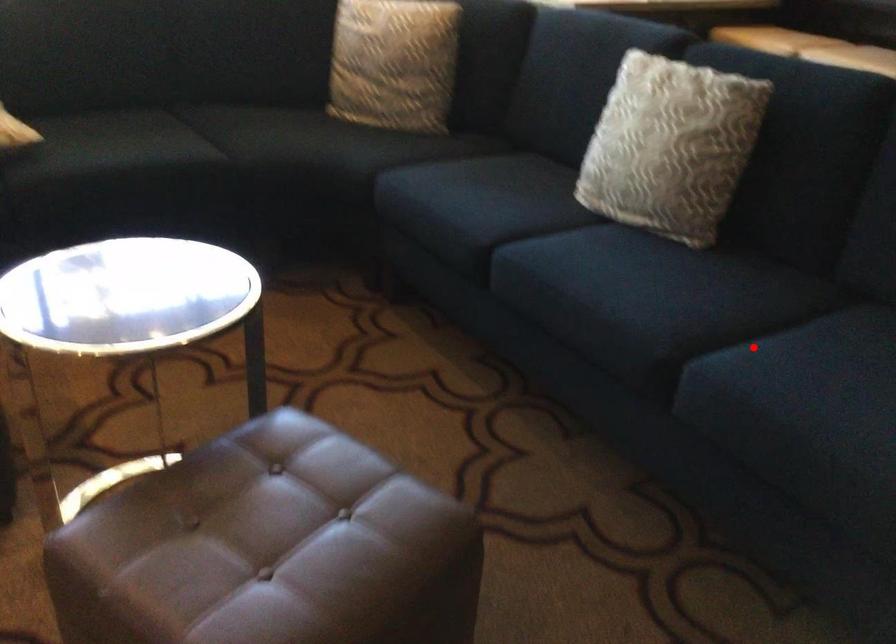
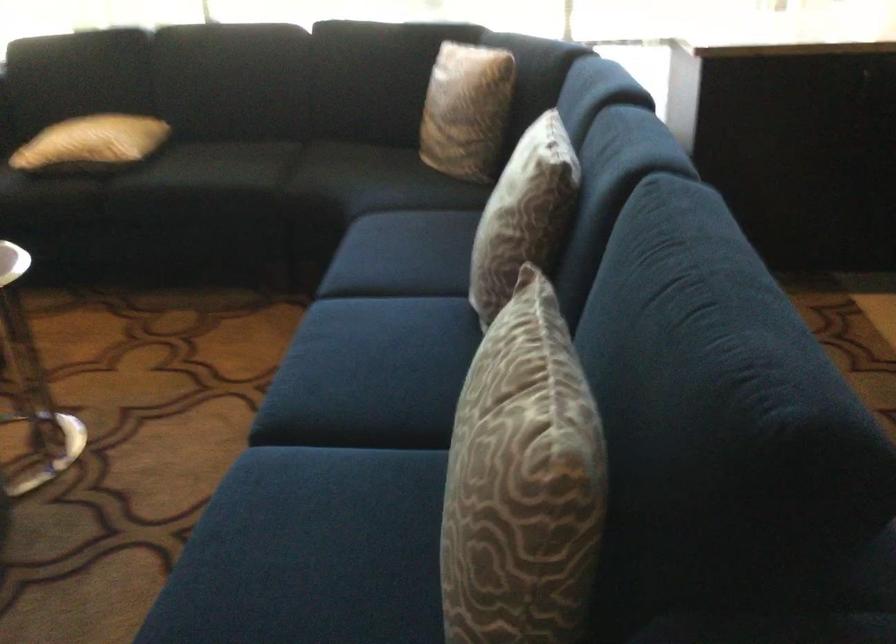
Find the pixel in the second image that matches the highlighted location in the first image.

(341, 458)